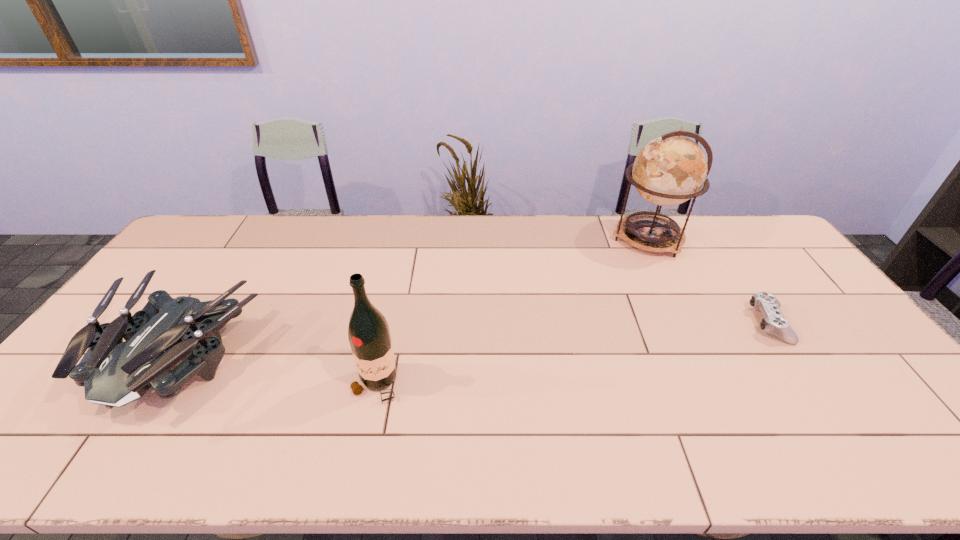
Where is `vacant space situated at the center of the third object from left to right`? The height and width of the screenshot is (540, 960). vacant space situated at the center of the third object from left to right is located at coordinates (549, 238).

Locate an element on the screen. vacant space positioned 0.380m on the right of the wine bottle is located at coordinates (548, 384).

The image size is (960, 540). Identify the location of free space located 0.170m on the right of the leftmost object. (324, 356).

Find the location of `vacant region located 0.180m on the left of the control`. vacant region located 0.180m on the left of the control is located at coordinates (687, 324).

At what (x,y) coordinates should I click in order to perform the action: click on object that is at the far edge. Please return your answer as a coordinate pair (x, y). The image size is (960, 540). Looking at the image, I should click on (669, 170).

At what (x,y) coordinates should I click in order to perform the action: click on object that is at the left edge. Please return your answer as a coordinate pair (x, y). Image resolution: width=960 pixels, height=540 pixels. Looking at the image, I should click on (114, 373).

At what (x,y) coordinates should I click in order to perform the action: click on object that is at the right edge. Please return your answer as a coordinate pair (x, y). The image size is (960, 540). Looking at the image, I should click on (773, 322).

Locate an element on the screen. The width and height of the screenshot is (960, 540). vacant space at the far edge is located at coordinates (487, 218).

Locate an element on the screen. vacant region at the near edge is located at coordinates (779, 447).

In the image, there is a desktop. At what (x,y) coordinates should I click in order to perform the action: click on free space at the right edge. Please return your answer as a coordinate pair (x, y). Image resolution: width=960 pixels, height=540 pixels. Looking at the image, I should click on (761, 257).